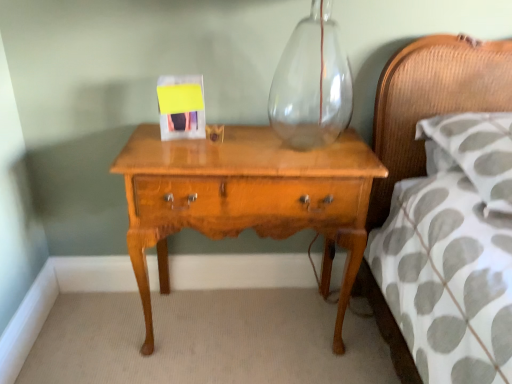
What do you see at coordinates (245, 198) in the screenshot?
I see `light brown wood nightstand at center` at bounding box center [245, 198].

The height and width of the screenshot is (384, 512). Find the location of `light brown wood nightstand at center`. light brown wood nightstand at center is located at coordinates (245, 198).

Find the location of a particular element. The image size is (512, 384). white textured pillow at right is located at coordinates (473, 152).

Describe the element at coordinates (473, 152) in the screenshot. Image resolution: width=512 pixels, height=384 pixels. I see `white textured pillow at right` at that location.

Identify the location of light brown wood nightstand at center. This screenshot has width=512, height=384. (245, 198).

In the scene shown: Can you confirm if white textured pillow at right is positioned to the left of light brown wood nightstand at center?

No.

Which object is further away from the camera, white textured pillow at right or light brown wood nightstand at center?

light brown wood nightstand at center is further away from the camera.

Which point is more forward, (421, 125) or (194, 217)?

Positioned in front is point (194, 217).

From the image's perspective, relative to light brown wood nightstand at center, is white textured pillow at right above or below?

From the image's perspective, white textured pillow at right appears above light brown wood nightstand at center.

From a real-world perspective, is white textured pillow at right on top of light brown wood nightstand at center?

Yes, from a real-world perspective, white textured pillow at right is on top of light brown wood nightstand at center.

Between white textured pillow at right and light brown wood nightstand at center, which one has smaller width?

Thinner between the two is light brown wood nightstand at center.

Which of these two, white textured pillow at right or light brown wood nightstand at center, stands shorter?

white textured pillow at right.

Which of these two, white textured pillow at right or light brown wood nightstand at center, is bigger?

Bigger between the two is light brown wood nightstand at center.

Is white textured pillow at right not inside light brown wood nightstand at center?

Absolutely, white textured pillow at right is external to light brown wood nightstand at center.

Is white textured pillow at right not close to light brown wood nightstand at center?

That's not correct — white textured pillow at right is a little close to light brown wood nightstand at center.

Is white textured pillow at right turned away from light brown wood nightstand at center?

No.

How different are the orientations of white textured pillow at right and light brown wood nightstand at center in degrees?

white textured pillow at right and light brown wood nightstand at center are facing 1.57 degrees away from each other.

Measure the distance from white textured pillow at right to light brown wood nightstand at center.

white textured pillow at right is 19.52 inches away from light brown wood nightstand at center.

Identify the location of nightstand that appears below the white textured pillow at right (from the image's perspective). The width and height of the screenshot is (512, 384). (245, 198).

Considering the positions of objects light brown wood nightstand at center and white textured pillow at right in the image provided, who is more to the left, light brown wood nightstand at center or white textured pillow at right?

From the viewer's perspective, light brown wood nightstand at center appears more on the left side.

Who is more distant, light brown wood nightstand at center or white textured pillow at right?

light brown wood nightstand at center is further from the camera.

Considering the positions of point (283, 187) and point (475, 127), is point (283, 187) closer or farther from the camera than point (475, 127)?

Point (283, 187) is closer to the camera than point (475, 127).

From the image's perspective, is light brown wood nightstand at center located beneath white textured pillow at right?

Yes, from the image's perspective, light brown wood nightstand at center is below white textured pillow at right.

From a real-world perspective, is light brown wood nightstand at center physically below white textured pillow at right?

Indeed, from a real-world perspective, light brown wood nightstand at center is positioned beneath white textured pillow at right.

In terms of width, does light brown wood nightstand at center look wider or thinner when compared to white textured pillow at right?

In the image, light brown wood nightstand at center appears to be more narrow than white textured pillow at right.

Which of these two, light brown wood nightstand at center or white textured pillow at right, stands taller?

light brown wood nightstand at center.

Which of these two, light brown wood nightstand at center or white textured pillow at right, is bigger?

Bigger between the two is light brown wood nightstand at center.

Do you think light brown wood nightstand at center is within white textured pillow at right, or outside of it?

light brown wood nightstand at center is located beyond the bounds of white textured pillow at right.

Would you consider light brown wood nightstand at center to be distant from white textured pillow at right?

light brown wood nightstand at center is actually quite close to white textured pillow at right.

Is light brown wood nightstand at center oriented away from white textured pillow at right?

No, light brown wood nightstand at center's orientation is not away from white textured pillow at right.

How distant is light brown wood nightstand at center from white textured pillow at right?

light brown wood nightstand at center is 49.58 centimeters away from white textured pillow at right.

You are a GUI agent. You are given a task and a screenshot of the screen. Output one action in this format:
    pyautogui.click(x=<x>, y=<y>)
    Task: Click on the nightstand beneath the white textured pillow at right (from a real-world perspective)
    
    Given the screenshot: What is the action you would take?
    pyautogui.click(x=245, y=198)

Find the location of `nightstand below the white textured pillow at right (from a real-world perspective)`. nightstand below the white textured pillow at right (from a real-world perspective) is located at coordinates (245, 198).

The image size is (512, 384). I want to click on pillow that is above the light brown wood nightstand at center (from a real-world perspective), so click(x=473, y=152).